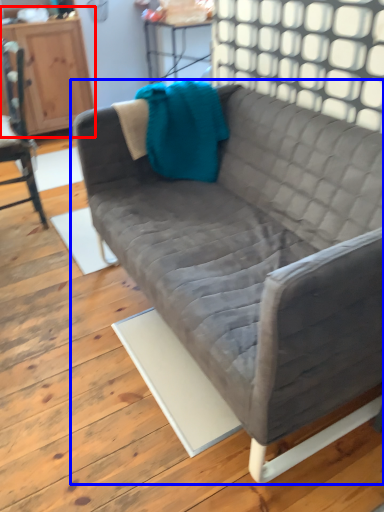
Question: Which object appears farthest to the camera in this image, dresser (highlighted by a red box) or studio couch (highlighted by a blue box)?

Choices:
 (A) dresser
 (B) studio couch

Answer: (A)